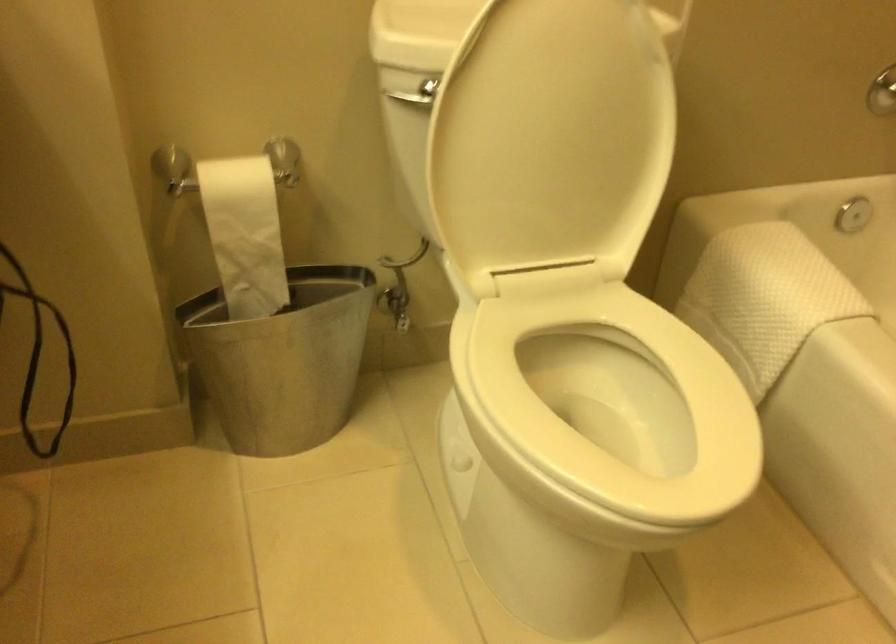
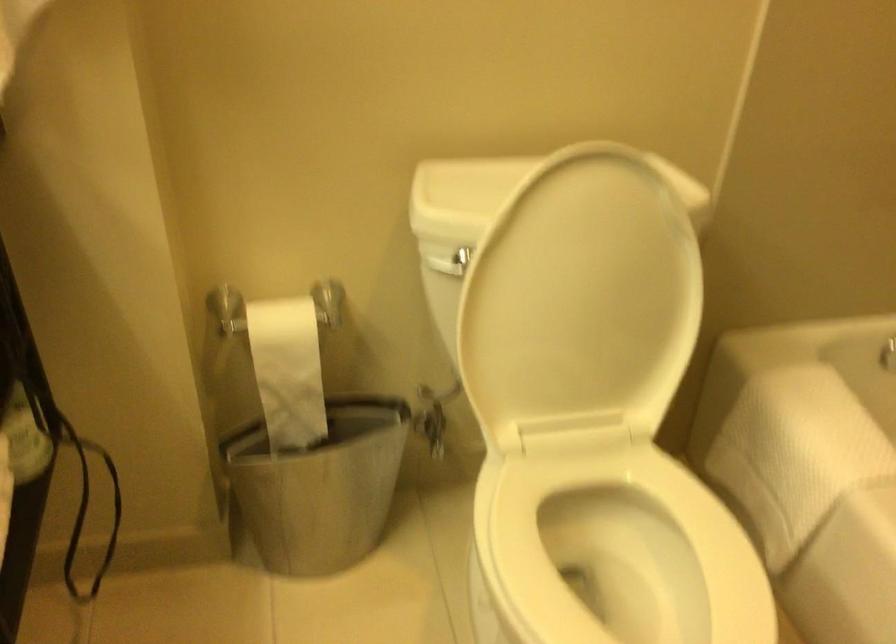
Locate, in the second image, the point that corresponds to (x=583, y=401) in the first image.

(607, 554)